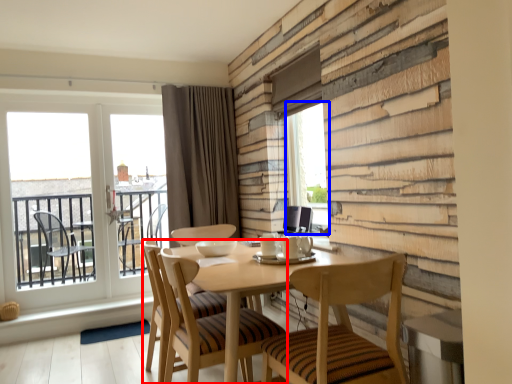
Question: Which object appears farthest to the camera in this image, chair (highlighted by a red box) or window screen (highlighted by a blue box)?

Choices:
 (A) chair
 (B) window screen

Answer: (B)